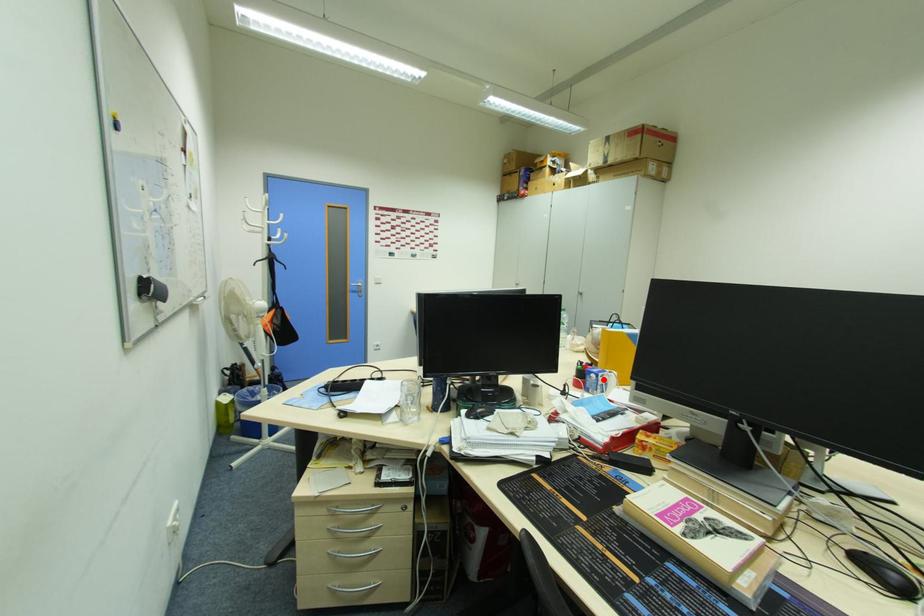
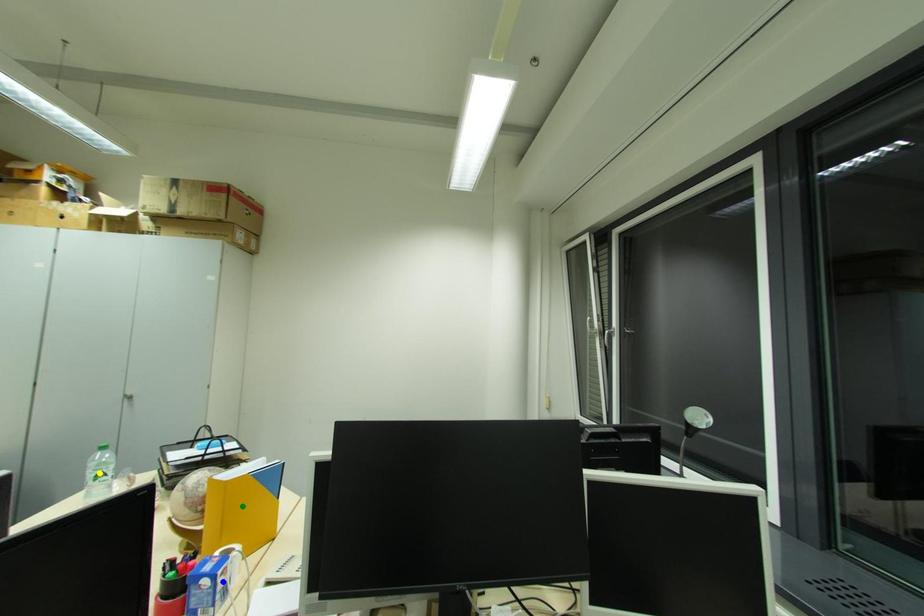
Question: I am providing you with two images of the same scene from different viewpoints. A red point is marked on the first image. You are given multiple points on the second image. Which point in image 2 represents the same 3d spot as the red point in image 1?

Choices:
 (A) green point
 (B) blue point
 (C) yellow point

Answer: (B)